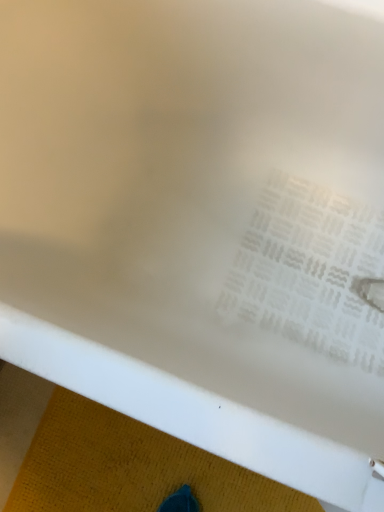
Describe the element at coordinates (131, 468) in the screenshot. This screenshot has width=384, height=512. I see `mustard woven mat at lower left` at that location.

You are a GUI agent. You are given a task and a screenshot of the screen. Output one action in this format:
    pyautogui.click(x=<x>, y=<y>)
    Task: Click on the mustard woven mat at lower left
    The image size is (384, 512).
    Given the screenshot: What is the action you would take?
    pyautogui.click(x=131, y=468)

Locate an element on the screen. mustard woven mat at lower left is located at coordinates (x=131, y=468).